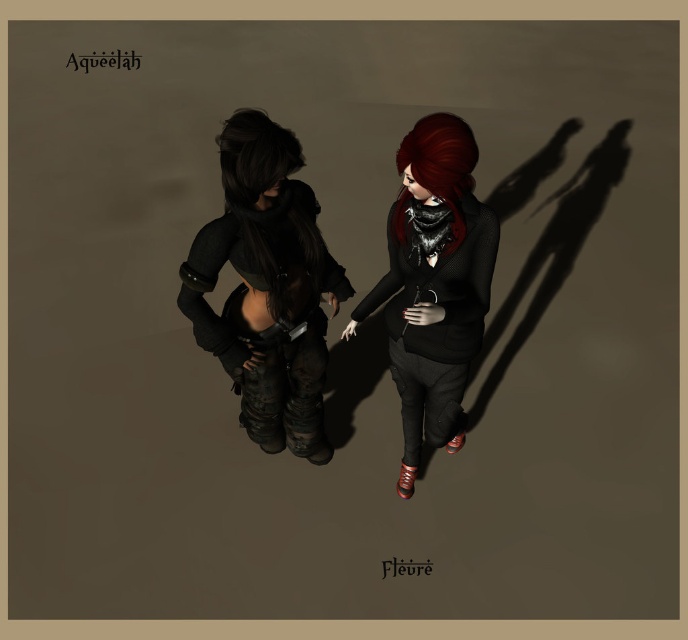
You are a photographer setting up a shoot for two characters. The scene requires the characters to stand exactly 2 meters apart. You have a matte black jacket at center. Can you position them correctly using the current spacing between the characters?

The characters are currently 2.05 meters apart, which is slightly more than the required 2 meters. To meet the requirement, you should move them closer by 5 centimeters.

You are an artist preparing to sketch the two characters in the scene. You notice the matte black sweater at center and the shiny black hair at center. Which object should you draw first if you want to capture the one that appears taller in the image?

The matte black sweater at center has a greater height compared to the shiny black hair at center, so you should draw the matte black sweater at center first to capture the taller object.

You are an artist trying to draw the two characters from the image. You need to decide which object to sketch first based on their sizes. Since the matte black sweater at center and the shiny black hair at center are both at the center, which one should you start with if you want to draw the wider object first?

The matte black sweater at center is wider than the shiny black hair at center, so you should start with the matte black sweater at center first.